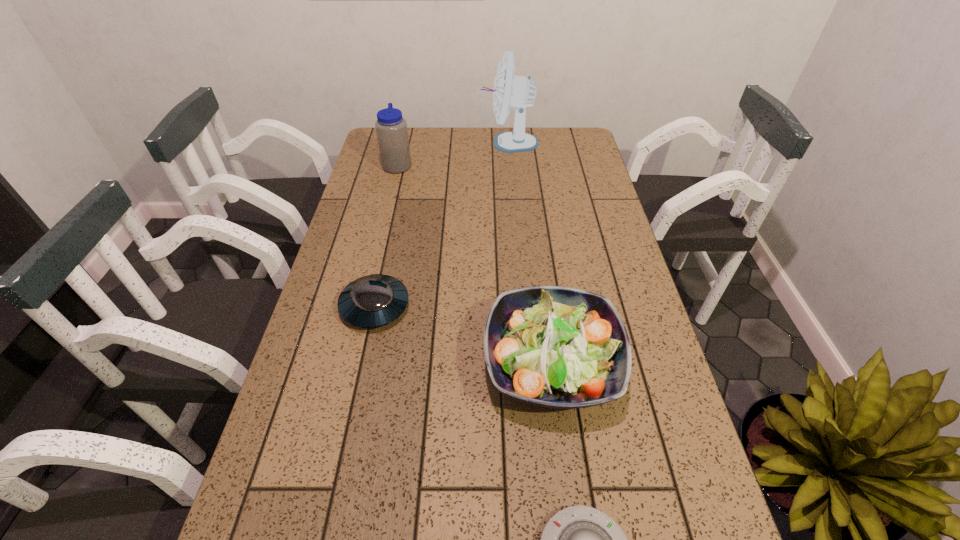
Where is `fan`? This screenshot has width=960, height=540. fan is located at coordinates (518, 92).

What are the coordinates of `water bottle` in the screenshot? It's located at click(391, 128).

The width and height of the screenshot is (960, 540). Identify the location of the third tallest object. [x=551, y=346].

Where is `the taller saucer`? This screenshot has height=540, width=960. the taller saucer is located at coordinates (371, 301).

Find the location of `the left saucer`. the left saucer is located at coordinates (371, 301).

Where is `vacant space located 0.380m on the grille of the tallest object`? This screenshot has width=960, height=540. vacant space located 0.380m on the grille of the tallest object is located at coordinates point(378,143).

Locate an element on the screen. vacant point located on the grille of the tallest object is located at coordinates (399, 143).

Locate an element on the screen. This screenshot has height=540, width=960. free region located on the grille of the tallest object is located at coordinates (448, 143).

At what (x,y) coordinates should I click in order to perform the action: click on free spot located with a carrying loop on the side of the water bottle. Please return your answer as a coordinate pair (x, y). Looking at the image, I should click on (499, 165).

What are the coordinates of `blank space located on the front of the salad plate` in the screenshot? It's located at (568, 497).